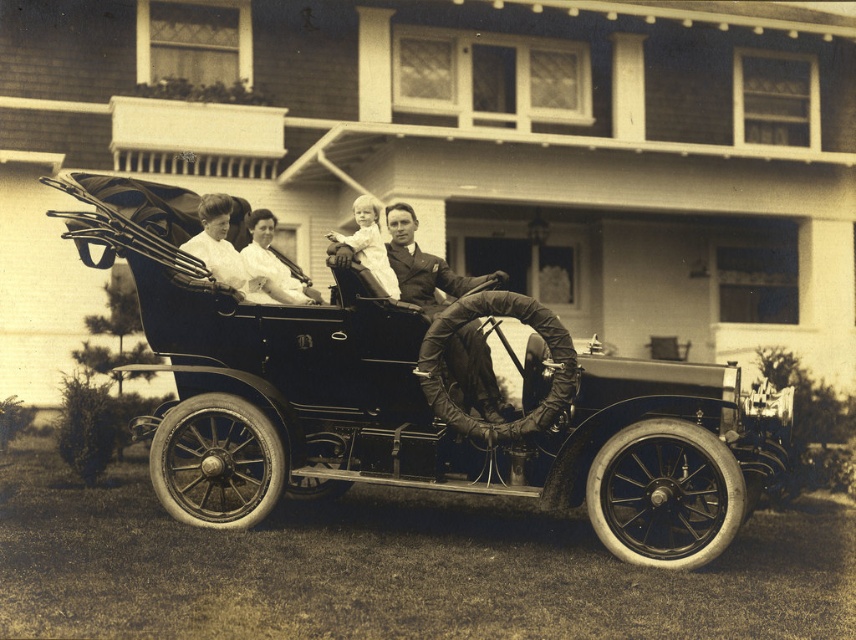
Which is more to the right, polished wood car at center or smooth white baby at center?

polished wood car at center

Does polished wood car at center appear under smooth white baby at center?

Yes, polished wood car at center is below smooth white baby at center.

Find the location of a particular element. The height and width of the screenshot is (640, 856). polished wood car at center is located at coordinates (417, 403).

At what (x,y) coordinates should I click in order to perform the action: click on polished wood car at center. Please return your answer as a coordinate pair (x, y). Looking at the image, I should click on (417, 403).

Between smooth white dress at center and smooth white baby at center, which one has less height?

With less height is smooth white baby at center.

Can you confirm if smooth white dress at center is taller than smooth white baby at center?

Indeed, smooth white dress at center has a greater height compared to smooth white baby at center.

At what (x,y) coordinates should I click in order to perform the action: click on smooth white dress at center. Please return your answer as a coordinate pair (x, y). The image size is (856, 640). Looking at the image, I should click on (272, 262).

Locate an element on the screen. smooth white dress at center is located at coordinates (272, 262).

Can you confirm if smooth leather jacket at center is positioned to the right of smooth white dress at center?

Correct, you'll find smooth leather jacket at center to the right of smooth white dress at center.

Who is higher up, smooth leather jacket at center or smooth white dress at center?

smooth white dress at center

Is point (391, 264) positioned in front of point (253, 262)?

No, it is not.

Find the location of a particular element. Image resolution: width=856 pixels, height=640 pixels. smooth leather jacket at center is located at coordinates (421, 262).